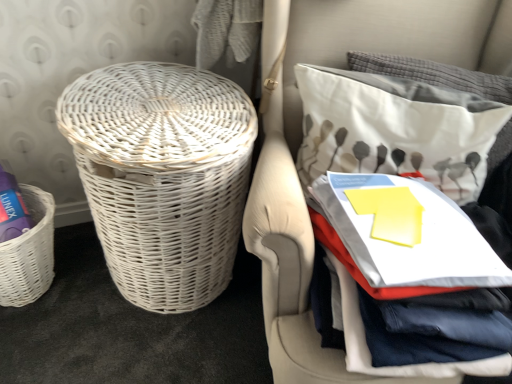
Question: In terms of width, does white wicker basket at left, the 2th basket positioned from the left, look wider or thinner when compared to white fabric pillow at upper right?

Choices:
 (A) wide
 (B) thin

Answer: (A)

Question: From their relative heights in the image, would you say white wicker basket at left, the 2th basket positioned from the left, is taller or shorter than white fabric pillow at upper right?

Choices:
 (A) tall
 (B) short

Answer: (A)

Question: Considering the real-world distances, which object is farthest from the white wicker basket at left, placed as the second basket when sorted from right to left?

Choices:
 (A) white wicker basket at left
 (B) white wicker basket at left, the 2th basket positioned from the left
 (C) white fabric pillow at upper right

Answer: (C)

Question: Which of these objects is positioned farthest from the white fabric pillow at upper right?

Choices:
 (A) white wicker basket at left
 (B) white wicker basket at left, the first basket from the right
 (C) white wicker basket at left, which is the 1th basket from left to right

Answer: (C)